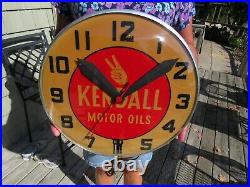
The width and height of the screenshot is (250, 187). I want to click on clock, so click(195, 85).